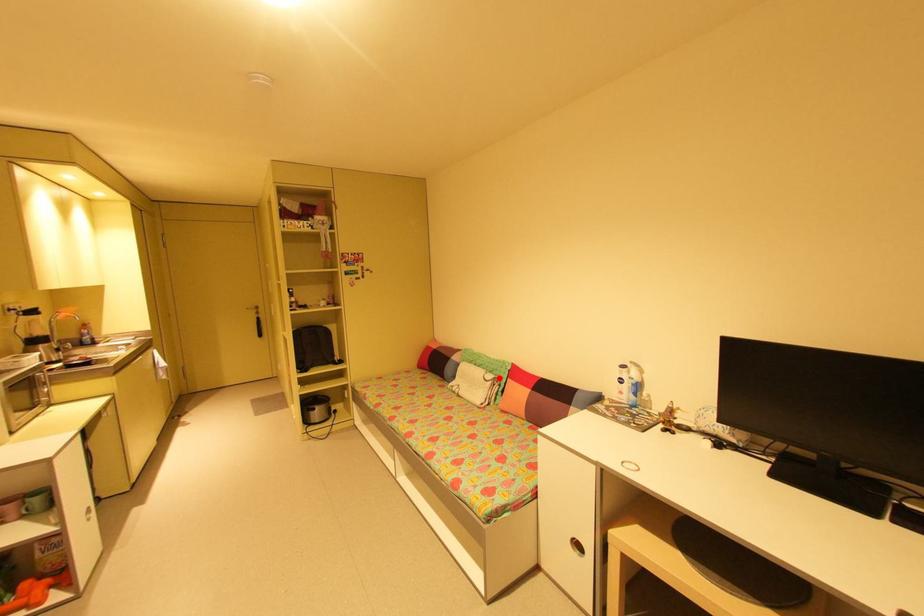
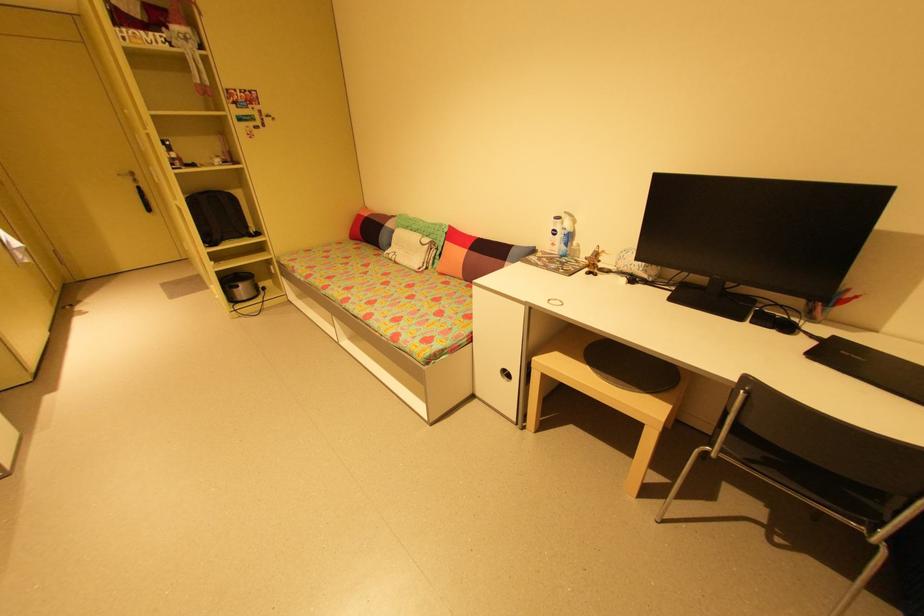
Question: I am providing you with two images of the same scene from different viewpoints. Given a red point in image1, look at the same physical point in image2. Is it:

Choices:
 (A) Closer to the viewpoint
 (B) Farther from the viewpoint

Answer: (A)